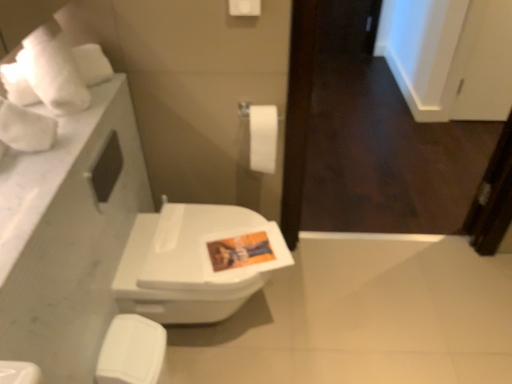
Find the location of `unoccupied region to the right of white glossy toilet at center`. unoccupied region to the right of white glossy toilet at center is located at coordinates (318, 314).